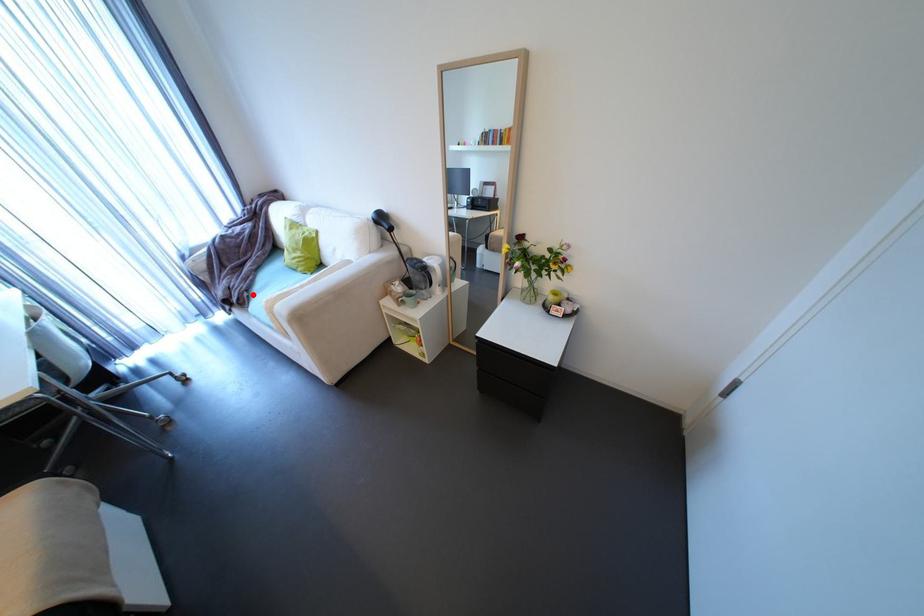
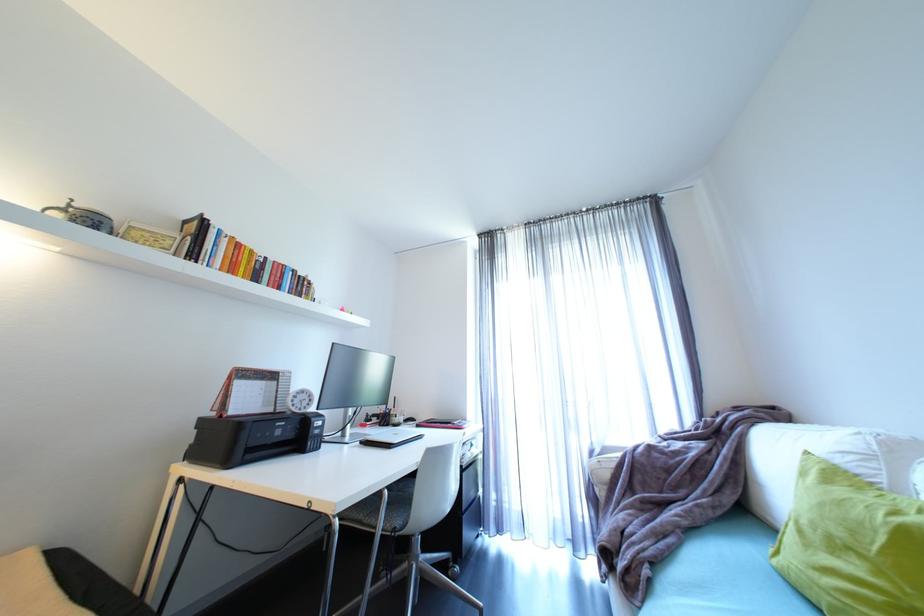
Question: I am providing you with two images of the same scene from different viewpoints. Image1 has a red point marked. In image2, the corresponding 3D location appears at what relative position? Reply with the corresponding letter.

Choices:
 (A) Closer
 (B) Farther

Answer: (A)